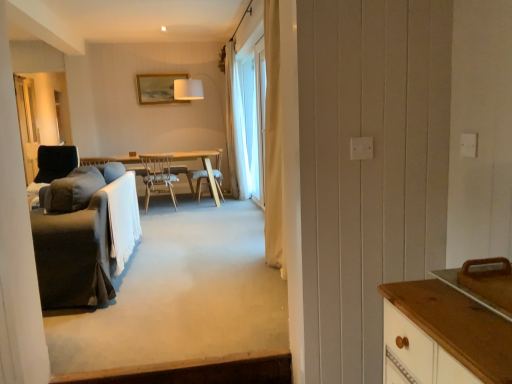
Question: Is the depth of black fabric screen door at left less than that of wooden frame at upper center?

Choices:
 (A) yes
 (B) no

Answer: (A)

Question: Is black fabric screen door at left located outside wooden frame at upper center?

Choices:
 (A) yes
 (B) no

Answer: (A)

Question: From the image's perspective, is black fabric screen door at left below wooden frame at upper center?

Choices:
 (A) yes
 (B) no

Answer: (A)

Question: Considering the relative sizes of black fabric screen door at left and wooden frame at upper center in the image provided, is black fabric screen door at left taller than wooden frame at upper center?

Choices:
 (A) no
 (B) yes

Answer: (B)

Question: From a real-world perspective, is black fabric screen door at left positioned over wooden frame at upper center based on gravity?

Choices:
 (A) yes
 (B) no

Answer: (B)

Question: Based on their positions, is soft gray carpet at center located to the left or right of dark gray fabric couch at left?

Choices:
 (A) right
 (B) left

Answer: (A)

Question: From a real-world perspective, is soft gray carpet at center physically located above or below dark gray fabric couch at left?

Choices:
 (A) above
 (B) below

Answer: (B)

Question: Considering the positions of point (78, 357) and point (51, 283), is point (78, 357) closer or farther from the camera than point (51, 283)?

Choices:
 (A) closer
 (B) farther

Answer: (A)

Question: Is soft gray carpet at center spatially inside dark gray fabric couch at left, or outside of it?

Choices:
 (A) outside
 (B) inside

Answer: (A)

Question: Relative to light wood table at center, is wooden chair at center, the second chair positioned from the front, in front or behind?

Choices:
 (A) front
 (B) behind

Answer: (B)

Question: Is wooden chair at center, placed as the second chair when sorted from left to right, bigger or smaller than light wood table at center?

Choices:
 (A) small
 (B) big

Answer: (A)

Question: Is wooden chair at center, the 1th chair viewed from the right, spatially inside light wood table at center, or outside of it?

Choices:
 (A) inside
 (B) outside

Answer: (A)

Question: Looking at their shapes, would you say wooden chair at center, the first chair positioned from the back, is wider or thinner than light wood table at center?

Choices:
 (A) wide
 (B) thin

Answer: (B)

Question: Is point (23, 86) positioned closer to the camera than point (259, 127)?

Choices:
 (A) closer
 (B) farther

Answer: (B)

Question: From the image's perspective, is black fabric screen door at left positioned above or below white sheer curtain at center?

Choices:
 (A) below
 (B) above

Answer: (B)